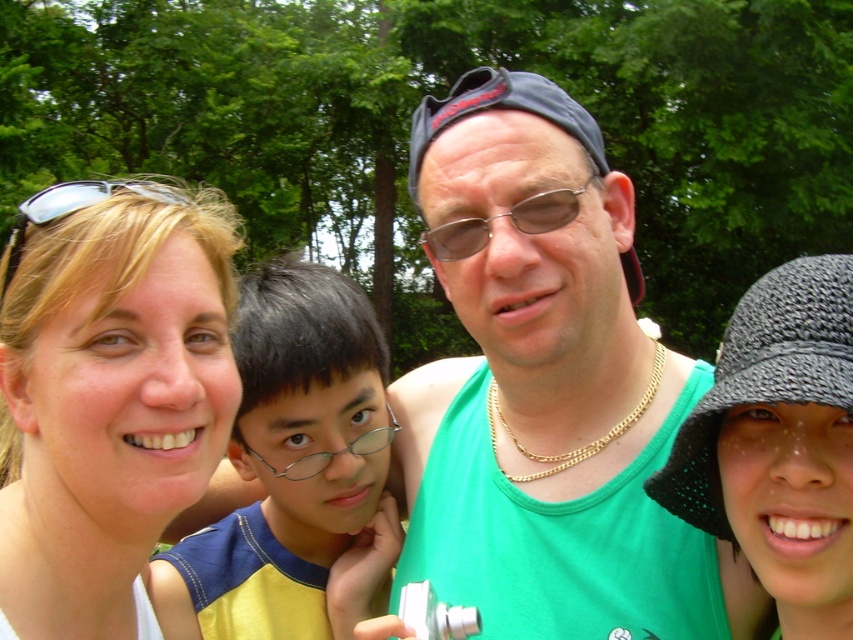
From the picture: Which of these two, green fabric tank top at center or blonde hair at upper left, stands taller?

Standing taller between the two is green fabric tank top at center.

Who is lower down, green fabric tank top at center or blonde hair at upper left?

Positioned lower is blonde hair at upper left.

The height and width of the screenshot is (640, 853). I want to click on green fabric tank top at center, so tap(548, 388).

Where is `green fabric tank top at center`? The height and width of the screenshot is (640, 853). green fabric tank top at center is located at coordinates (548, 388).

Is green fabric tank top at center to the right of yellow fabric shirt at center from the viewer's perspective?

Yes, green fabric tank top at center is to the right of yellow fabric shirt at center.

What do you see at coordinates (548, 388) in the screenshot?
I see `green fabric tank top at center` at bounding box center [548, 388].

The image size is (853, 640). I want to click on green fabric tank top at center, so 548,388.

Is blonde hair at upper left positioned behind yellow fabric shirt at center?

No, it is in front of yellow fabric shirt at center.

Which is behind, point (204, 310) or point (297, 397)?

The point (297, 397) is behind.

This screenshot has height=640, width=853. What do you see at coordinates (108, 397) in the screenshot?
I see `blonde hair at upper left` at bounding box center [108, 397].

In order to click on blonde hair at upper left in this screenshot , I will do `click(108, 397)`.